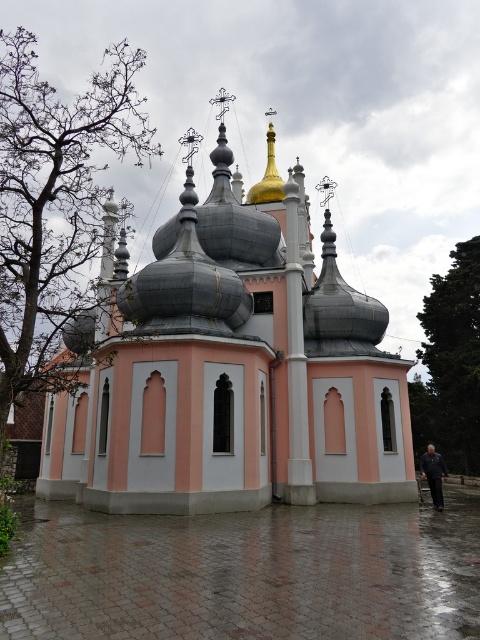
You are standing at the entrance of the church and notice two points marked on the ground. The first point is labeled as point (100,490) and the second is point (274,164). If you were to walk from the entrance towards the golden dome, which point would you encounter first?

Point (100,490) is in front of point (274,164), so you would encounter point (100,490) first when walking towards the golden dome.

You are standing in front of the church and want to walk from point [272,173] to point [423,472]. Since both points are on the ground in front of the church, which direction should you move relative to the church to reach your destination?

You should move away from the church because point [272,173] is closer to the church than point [423,472], so moving away from the church will take you toward the farther point.